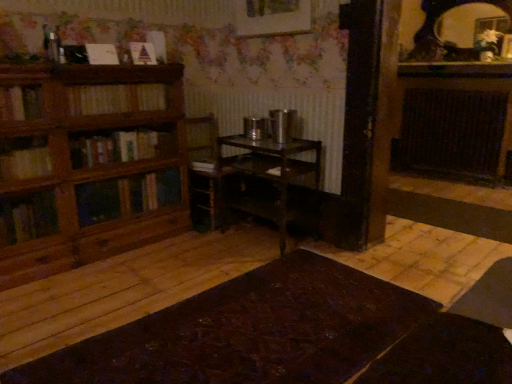
Question: Is matte black mirror at upper right positioned behind dark brown wooden radiator at right?

Choices:
 (A) no
 (B) yes

Answer: (A)

Question: Are matte black mirror at upper right and dark brown wooden radiator at right far apart?

Choices:
 (A) yes
 (B) no

Answer: (A)

Question: Does matte black mirror at upper right turn towards dark brown wooden radiator at right?

Choices:
 (A) no
 (B) yes

Answer: (A)

Question: Can you confirm if matte black mirror at upper right is positioned to the right of dark brown wooden radiator at right?

Choices:
 (A) no
 (B) yes

Answer: (A)

Question: Is matte black mirror at upper right smaller than dark brown wooden radiator at right?

Choices:
 (A) yes
 (B) no

Answer: (A)

Question: Is the depth of matte black mirror at upper right less than that of dark brown wooden radiator at right?

Choices:
 (A) no
 (B) yes

Answer: (B)

Question: Is wooden picture frame at upper center next to metallic dark brown table at center, the second table positioned from the bottom, and touching it?

Choices:
 (A) no
 (B) yes

Answer: (A)

Question: Is wooden picture frame at upper center smaller than metallic dark brown table at center, the second table positioned from the bottom?

Choices:
 (A) yes
 (B) no

Answer: (A)

Question: Is wooden picture frame at upper center oriented away from metallic dark brown table at center, placed as the 1th table when sorted from top to bottom?

Choices:
 (A) no
 (B) yes

Answer: (A)

Question: From the image's perspective, would you say wooden picture frame at upper center is shown under metallic dark brown table at center, placed as the 1th table when sorted from top to bottom?

Choices:
 (A) yes
 (B) no

Answer: (B)

Question: From a real-world perspective, is wooden picture frame at upper center on metallic dark brown table at center, placed as the 1th table when sorted from top to bottom?

Choices:
 (A) yes
 (B) no

Answer: (A)

Question: Is wooden picture frame at upper center oriented towards metallic dark brown table at center, the second table positioned from the bottom?

Choices:
 (A) yes
 (B) no

Answer: (B)

Question: Is metallic dark brown table at center, the second table positioned from the bottom, smaller than wooden picture frame at upper center?

Choices:
 (A) yes
 (B) no

Answer: (B)